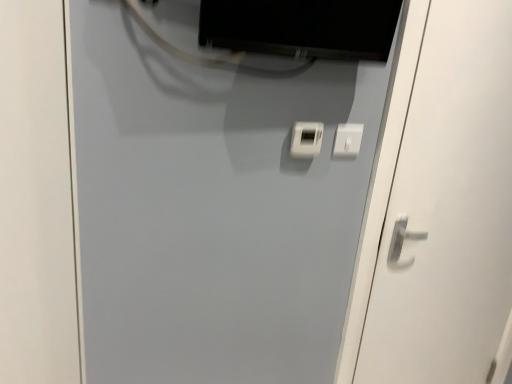
In order to click on matte black monitor at upper center in this screenshot , I will do `click(301, 27)`.

Locate an element on the screen. This screenshot has height=384, width=512. white glossy door handle at right, acting as the 1th door starting from the right is located at coordinates (449, 211).

Locate an element on the screen. This screenshot has width=512, height=384. white matte door at center, acting as the second door starting from the right is located at coordinates (36, 199).

From the image's perspective, which is below, white matte door at center, placed as the first door when sorted from left to right, or matte black monitor at upper center?

white matte door at center, placed as the first door when sorted from left to right.

Is white matte door at center, placed as the first door when sorted from left to right, aimed at matte black monitor at upper center?

No, white matte door at center, placed as the first door when sorted from left to right, is not aimed at matte black monitor at upper center.

Looking at this image, is white matte door at center, placed as the first door when sorted from left to right, wider than matte black monitor at upper center?

No, white matte door at center, placed as the first door when sorted from left to right, is not wider than matte black monitor at upper center.

Does white matte door at center, placed as the first door when sorted from left to right, have a greater height compared to matte black monitor at upper center?

Yes, white matte door at center, placed as the first door when sorted from left to right, is taller than matte black monitor at upper center.

Is white plastic light switch at center aimed at white matte door at center, placed as the first door when sorted from left to right?

No, white plastic light switch at center is not facing towards white matte door at center, placed as the first door when sorted from left to right.

Does white plastic light switch at center have a smaller size compared to white matte door at center, placed as the first door when sorted from left to right?

Indeed, white plastic light switch at center has a smaller size compared to white matte door at center, placed as the first door when sorted from left to right.

From the image's perspective, is white plastic light switch at center located above or below white matte door at center, acting as the second door starting from the right?

Based on their image positions, white plastic light switch at center is located above white matte door at center, acting as the second door starting from the right.

Can white matte door at center, acting as the second door starting from the right, be found inside white plastic light switch at center?

Actually, white matte door at center, acting as the second door starting from the right, is outside white plastic light switch at center.

Identify the location of door on the right of white matte door at center, placed as the first door when sorted from left to right. This screenshot has height=384, width=512. (449, 211).

Which of these two, white matte door at center, placed as the first door when sorted from left to right, or white glossy door handle at right, which is the 2th door in left-to-right order, is thinner?

white matte door at center, placed as the first door when sorted from left to right.

Can you tell me how much white matte door at center, acting as the second door starting from the right, and white glossy door handle at right, which is the 2th door in left-to-right order, differ in facing direction?

white matte door at center, acting as the second door starting from the right, and white glossy door handle at right, which is the 2th door in left-to-right order, are facing 1.46 degrees away from each other.

Between white matte door at center, placed as the first door when sorted from left to right, and white glossy door handle at right, which is the 2th door in left-to-right order, which one has more height?

white glossy door handle at right, which is the 2th door in left-to-right order, is taller.

Is point (446, 128) less distant than point (15, 61)?

No.

In order to click on door behind the white matte door at center, placed as the first door when sorted from left to right in this screenshot , I will do `click(449, 211)`.

Considering the sizes of objects white glossy door handle at right, which is the 2th door in left-to-right order, and white matte door at center, placed as the first door when sorted from left to right, in the image provided, who is wider, white glossy door handle at right, which is the 2th door in left-to-right order, or white matte door at center, placed as the first door when sorted from left to right,?

With larger width is white glossy door handle at right, which is the 2th door in left-to-right order.

How different are the orientations of white glossy door handle at right, acting as the 1th door starting from the right, and white matte door at center, acting as the second door starting from the right, in degrees?

1.46 degrees.

Between matte black monitor at upper center and white plastic light switch at center, which one has larger size?

matte black monitor at upper center is bigger.

Based on their positions, is matte black monitor at upper center located to the left or right of white plastic light switch at center?

matte black monitor at upper center is positioned on white plastic light switch at center's left side.

From the picture: Which is nearer, (392, 16) or (315, 146)?

Point (392, 16) is closer to the camera than point (315, 146).

Which object is thinner, matte black monitor at upper center or white plastic light switch at center?

white plastic light switch at center is thinner.

Could you tell me if white plastic light switch at center is facing matte black monitor at upper center?

No, white plastic light switch at center does not turn towards matte black monitor at upper center.

Can you confirm if white plastic light switch at center is smaller than matte black monitor at upper center?

Yes.

Is white plastic light switch at center further to camera compared to matte black monitor at upper center?

Yes, the depth of white plastic light switch at center is greater than that of matte black monitor at upper center.

Can you confirm if white plastic light switch at center is positioned to the left of matte black monitor at upper center?

Incorrect, white plastic light switch at center is not on the left side of matte black monitor at upper center.

Which of these two, white plastic light switch at center or white glossy door handle at right, which is the 2th door in left-to-right order, stands taller?

white glossy door handle at right, which is the 2th door in left-to-right order, is taller.

Is white plastic light switch at center wider than white glossy door handle at right, which is the 2th door in left-to-right order?

Incorrect, the width of white plastic light switch at center does not surpass that of white glossy door handle at right, which is the 2th door in left-to-right order.

Does point (313, 145) come behind point (505, 172)?

That is False.

Where is `computer monitor on the right of the white matte door at center, acting as the second door starting from the right`? The image size is (512, 384). computer monitor on the right of the white matte door at center, acting as the second door starting from the right is located at coordinates (301, 27).

The image size is (512, 384). In order to click on door that is the 2nd one below the white plastic light switch at center (from a real-world perspective) in this screenshot , I will do `click(36, 199)`.

Which object lies nearer to the anchor point matte black monitor at upper center, white glossy door handle at right, acting as the 1th door starting from the right, or white matte door at center, placed as the first door when sorted from left to right?

white glossy door handle at right, acting as the 1th door starting from the right, lies closer to matte black monitor at upper center than the other object.

When comparing their distances from white glossy door handle at right, which is the 2th door in left-to-right order, does white matte door at center, placed as the first door when sorted from left to right, or matte black monitor at upper center seem further?

white matte door at center, placed as the first door when sorted from left to right, lies further to white glossy door handle at right, which is the 2th door in left-to-right order, than the other object.

Considering their positions, is white matte door at center, placed as the first door when sorted from left to right, positioned further to matte black monitor at upper center than white glossy door handle at right, acting as the 1th door starting from the right?

Among the two, white matte door at center, placed as the first door when sorted from left to right, is located further to matte black monitor at upper center.

Which object lies nearer to the anchor point white matte door at center, acting as the second door starting from the right, matte black monitor at upper center or white plastic light switch at center?

Among the two, matte black monitor at upper center is located nearer to white matte door at center, acting as the second door starting from the right.

Estimate the real-world distances between objects in this image. Which object is further from white glossy door handle at right, which is the 2th door in left-to-right order, matte black monitor at upper center or white matte door at center, acting as the second door starting from the right?

white matte door at center, acting as the second door starting from the right.

Looking at the image, which one is located closer to white plastic light switch at center, matte black monitor at upper center or white matte door at center, acting as the second door starting from the right?

The object closer to white plastic light switch at center is matte black monitor at upper center.

From the image, which object appears to be farther from white matte door at center, placed as the first door when sorted from left to right, white glossy door handle at right, acting as the 1th door starting from the right, or white plastic light switch at center?

white glossy door handle at right, acting as the 1th door starting from the right, is further to white matte door at center, placed as the first door when sorted from left to right.

Estimate the real-world distances between objects in this image. Which object is further from matte black monitor at upper center, white glossy door handle at right, which is the 2th door in left-to-right order, or white plastic light switch at center?

white glossy door handle at right, which is the 2th door in left-to-right order, is further to matte black monitor at upper center.

You are a GUI agent. You are given a task and a screenshot of the screen. Output one action in this format:
    pyautogui.click(x=<x>, y=<y>)
    Task: Click on the computer monitor between white matte door at center, acting as the second door starting from the right, and white glossy door handle at right, which is the 2th door in left-to-right order, in the horizontal direction
    
    Given the screenshot: What is the action you would take?
    pyautogui.click(x=301, y=27)

Locate an element on the screen. light switch situated between matte black monitor at upper center and white glossy door handle at right, acting as the 1th door starting from the right, from left to right is located at coordinates (306, 139).

This screenshot has height=384, width=512. What are the coordinates of `light switch between white matte door at center, placed as the first door when sorted from left to right, and white glossy door handle at right, which is the 2th door in left-to-right order, from left to right` in the screenshot? It's located at (306, 139).

The height and width of the screenshot is (384, 512). I want to click on computer monitor between white matte door at center, acting as the second door starting from the right, and white plastic light switch at center, in the horizontal direction, so click(301, 27).